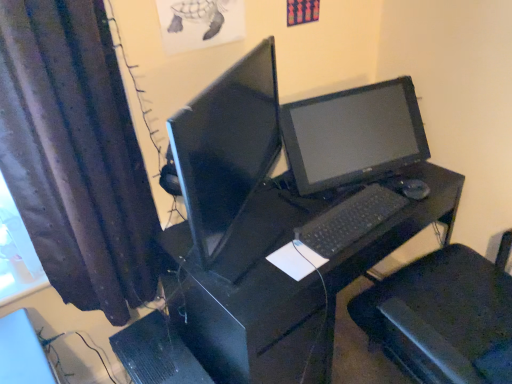
Identify the location of vacant space behind black plastic mouse at right. (402, 175).